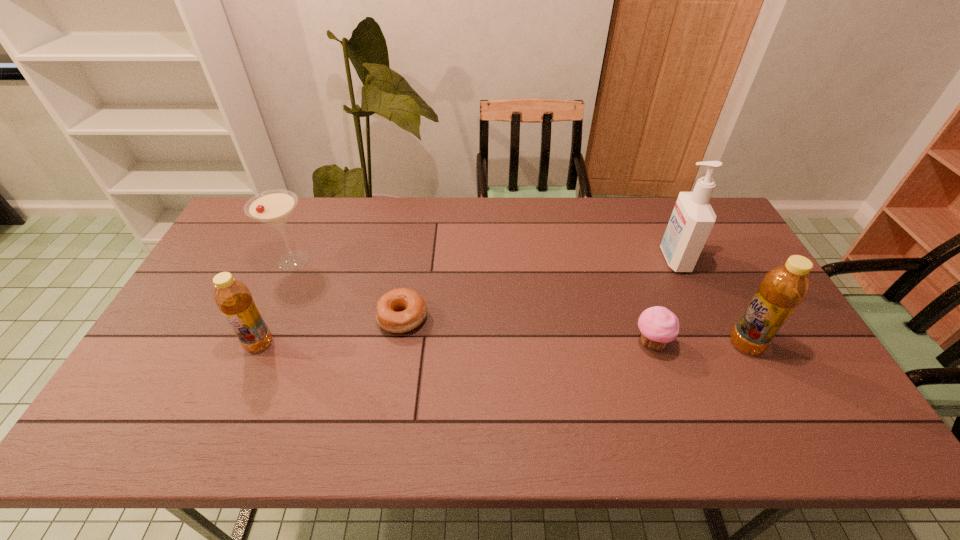
I want to click on vacant space that is in between the martini and the fifth shortest object, so click(519, 302).

Locate an element on the screen. This screenshot has height=540, width=960. empty space between the third object from left to right and the fourth object from left to right is located at coordinates (527, 330).

Locate an element on the screen. object that stands as the fourth closest to the third object from right to left is located at coordinates (273, 207).

This screenshot has width=960, height=540. Find the location of `object identified as the second closest to the left bottle`. object identified as the second closest to the left bottle is located at coordinates (400, 310).

The height and width of the screenshot is (540, 960). What are the coordinates of `vacant region that satisfies the following two spatial constraints: 1. on the back side of the fifth shortest object; 2. on the front label of the cleansing agent` in the screenshot? It's located at (702, 259).

Locate an element on the screen. vacant space that satisfies the following two spatial constraints: 1. on the back side of the taller bottle; 2. on the front label of the cleansing agent is located at coordinates (702, 259).